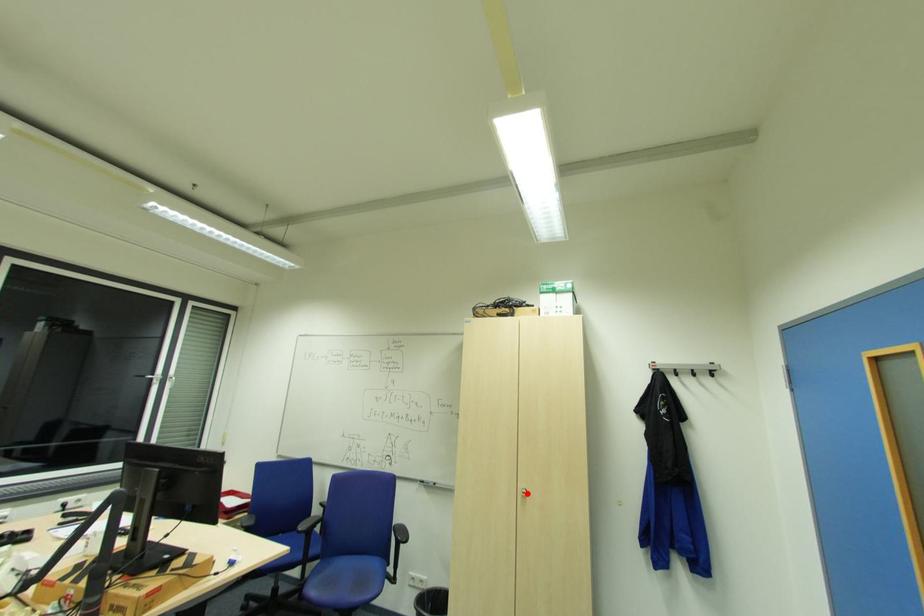
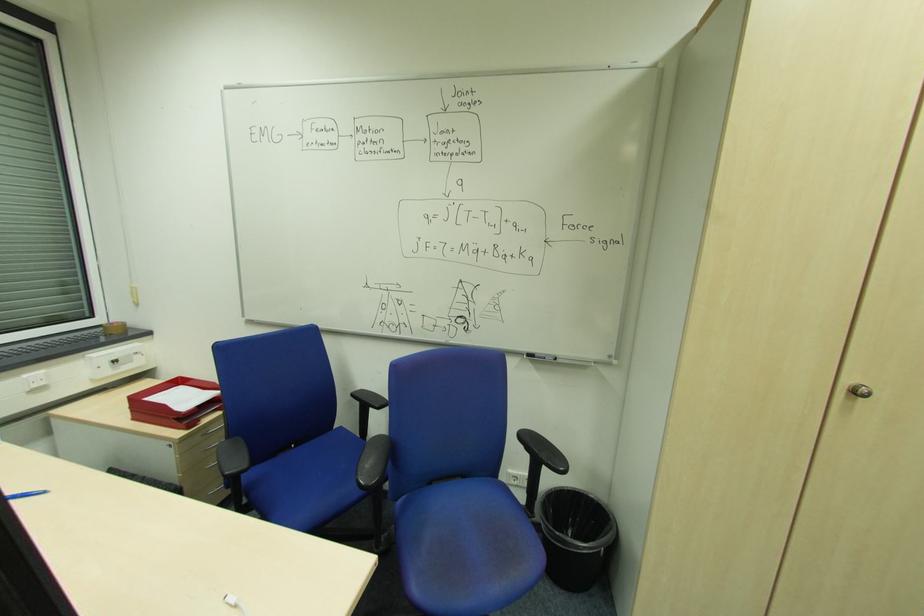
Find the pixel in the second image that matches the highlighted location in the first image.

(860, 392)